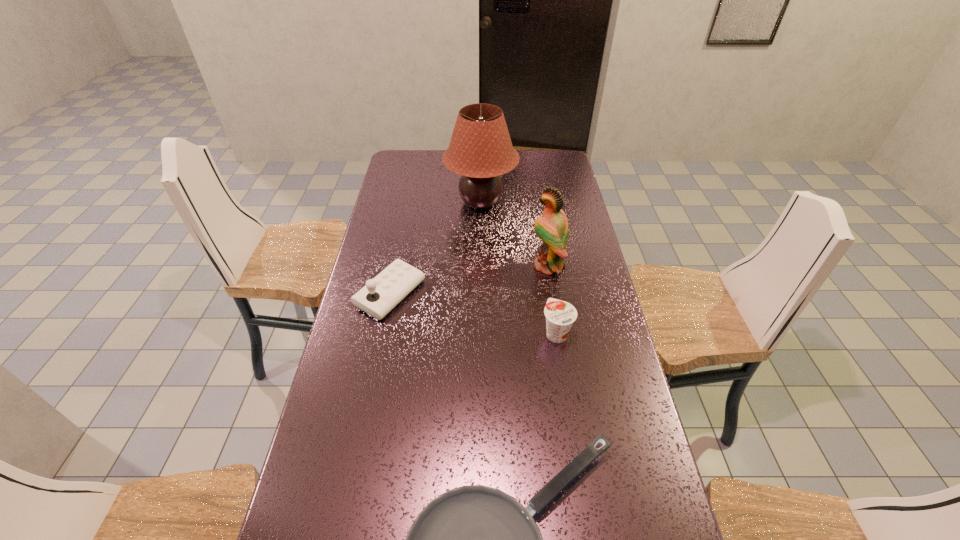
The height and width of the screenshot is (540, 960). I want to click on the farthest object, so click(x=480, y=150).

You are a GUI agent. You are given a task and a screenshot of the screen. Output one action in this format:
    pyautogui.click(x=<x>, y=<y>)
    Task: Click on the tallest object
    The image size is (960, 540).
    Given the screenshot: What is the action you would take?
    pyautogui.click(x=480, y=150)

Image resolution: width=960 pixels, height=540 pixels. Identify the location of the fourth shortest object. (552, 228).

At what (x,y) coordinates should I click in order to perform the action: click on the leftmost object. Please return your answer as a coordinate pair (x, y). Looking at the image, I should click on (380, 295).

Find the location of a particular element. This screenshot has width=960, height=540. the fourth tallest object is located at coordinates (560, 315).

Locate an element on the screen. vacant space located 0.300m on the front-facing side of the tallest object is located at coordinates point(481,276).

Where is `vacant area situated on the front-facing side of the parrot`? vacant area situated on the front-facing side of the parrot is located at coordinates (494, 266).

Image resolution: width=960 pixels, height=540 pixels. I want to click on vacant space located on the front-facing side of the parrot, so click(515, 266).

At what (x,y) coordinates should I click in order to perform the action: click on free space located on the front-facing side of the parrot. Please return your answer as a coordinate pair (x, y). Image resolution: width=960 pixels, height=540 pixels. Looking at the image, I should click on (427, 266).

Locate an element on the screen. The width and height of the screenshot is (960, 540). free space located on the right of the leftmost object is located at coordinates (529, 294).